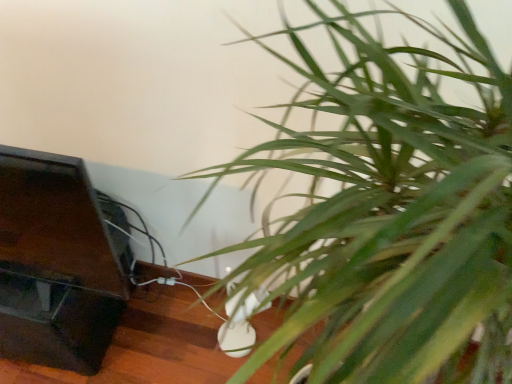
Question: Is dark wood table at lower left in front of or behind green leafy plant at lower right in the image?

Choices:
 (A) front
 (B) behind

Answer: (B)

Question: From a real-world perspective, is dark wood table at lower left above or below green leafy plant at lower right?

Choices:
 (A) above
 (B) below

Answer: (B)

Question: Looking at their shapes, would you say dark wood table at lower left is wider or thinner than green leafy plant at lower right?

Choices:
 (A) wide
 (B) thin

Answer: (B)

Question: From the image's perspective, is green leafy plant at lower right positioned above or below dark wood table at lower left?

Choices:
 (A) above
 (B) below

Answer: (A)

Question: From a real-world perspective, is green leafy plant at lower right above or below dark wood table at lower left?

Choices:
 (A) below
 (B) above

Answer: (B)

Question: Looking at their shapes, would you say green leafy plant at lower right is wider or thinner than dark wood table at lower left?

Choices:
 (A) thin
 (B) wide

Answer: (B)

Question: In the image, is green leafy plant at lower right on the left side or the right side of dark wood table at lower left?

Choices:
 (A) left
 (B) right

Answer: (B)